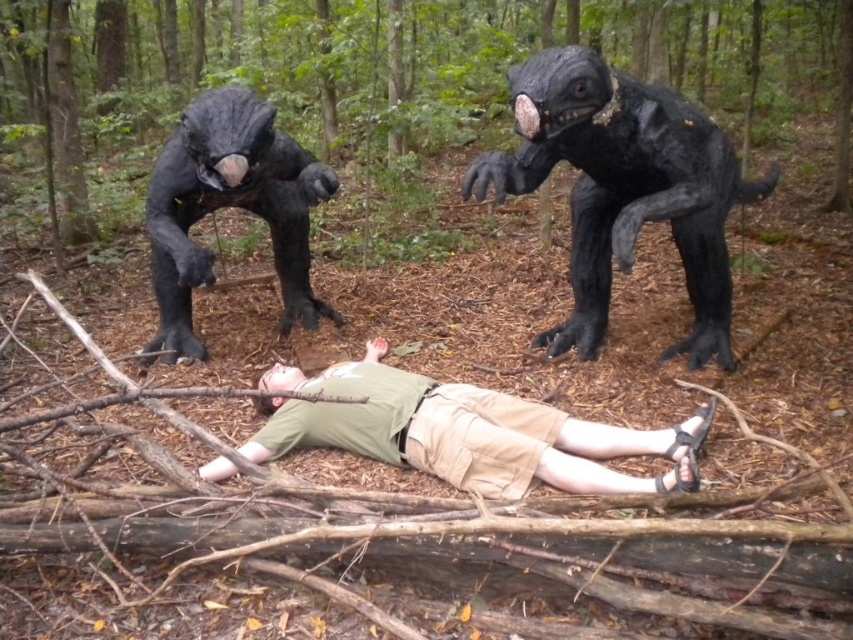
Question: Does shiny black creature at upper center have a greater width compared to green cotton shirt at center?

Choices:
 (A) yes
 (B) no

Answer: (B)

Question: Which point is closer to the camera?

Choices:
 (A) green cotton shirt at center
 (B) shiny black creature at upper left

Answer: (A)

Question: Can you confirm if shiny black creature at upper center is positioned above green cotton shirt at center?

Choices:
 (A) yes
 (B) no

Answer: (A)

Question: Is shiny black creature at upper center further to camera compared to green cotton shirt at center?

Choices:
 (A) yes
 (B) no

Answer: (A)

Question: Which object appears closest to the camera in this image?

Choices:
 (A) green cotton shirt at center
 (B) shiny black creature at upper left
 (C) shiny black creature at upper center

Answer: (A)

Question: Which object is the farthest from the shiny black creature at upper center?

Choices:
 (A) shiny black creature at upper left
 (B) green cotton shirt at center

Answer: (A)